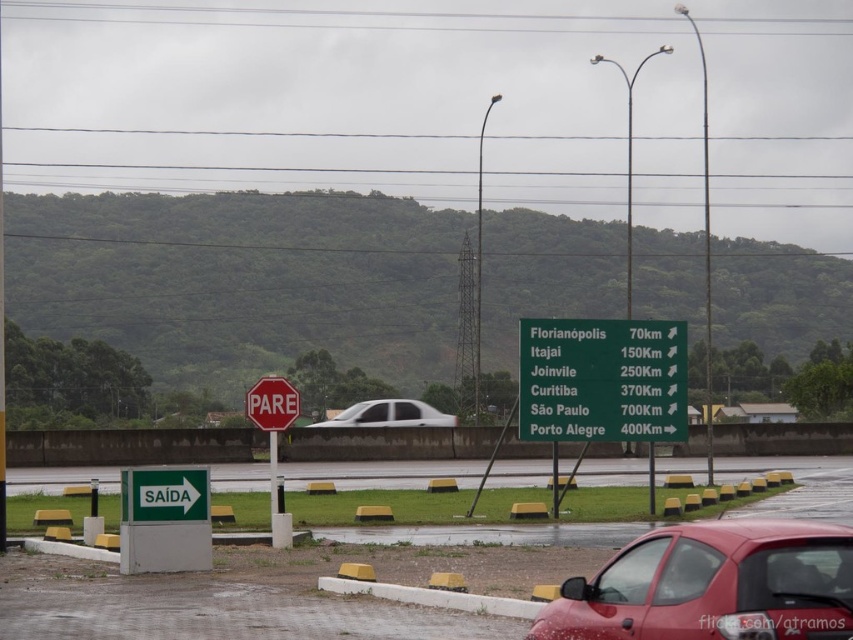
You are a driver approaching the intersection and see the green metallic sign at center. According to the scene description, where exactly is the green metallic sign positioned in relation to the other elements?

The green metallic sign at center is located at point coordinates (602,380).

You are a pedestrian standing at the center of the image. You want to cross the road to reach the shiny red car at lower right. Which direction should you walk to avoid the bollards and reach the car safely?

The shiny red car at lower right is located at coordinates point [712,586]. Since you are at the center, you should walk towards the lower right direction to reach the car safely while avoiding the bollards along the way.